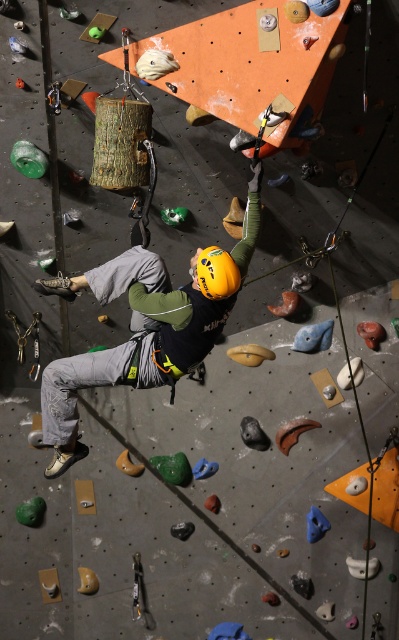
Question: Which of the following is the farthest from the observer?

Choices:
 (A) (203, 288)
 (B) (163, 380)

Answer: (B)

Question: Which object is farther from the camera taking this photo?

Choices:
 (A) yellow matte helmet at center
 (B) matte yellow helmet at center

Answer: (B)

Question: Is matte yellow helmet at center wider than yellow matte helmet at center?

Choices:
 (A) yes
 (B) no

Answer: (A)

Question: Is matte yellow helmet at center thinner than yellow matte helmet at center?

Choices:
 (A) yes
 (B) no

Answer: (B)

Question: Does matte yellow helmet at center have a smaller size compared to yellow matte helmet at center?

Choices:
 (A) no
 (B) yes

Answer: (A)